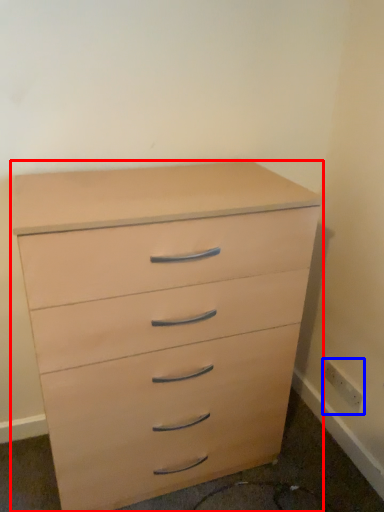
Question: Which object appears farthest to the camera in this image, chest of drawers (highlighted by a red box) or electric outlet (highlighted by a blue box)?

Choices:
 (A) chest of drawers
 (B) electric outlet

Answer: (B)